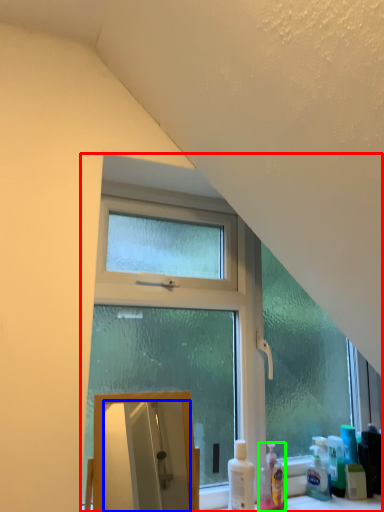
Question: Estimate the real-world distances between objects in this image. Which object is closer to window (highlighted by a red box), mirror (highlighted by a blue box) or cleaning product (highlighted by a green box)?

Choices:
 (A) mirror
 (B) cleaning product

Answer: (B)